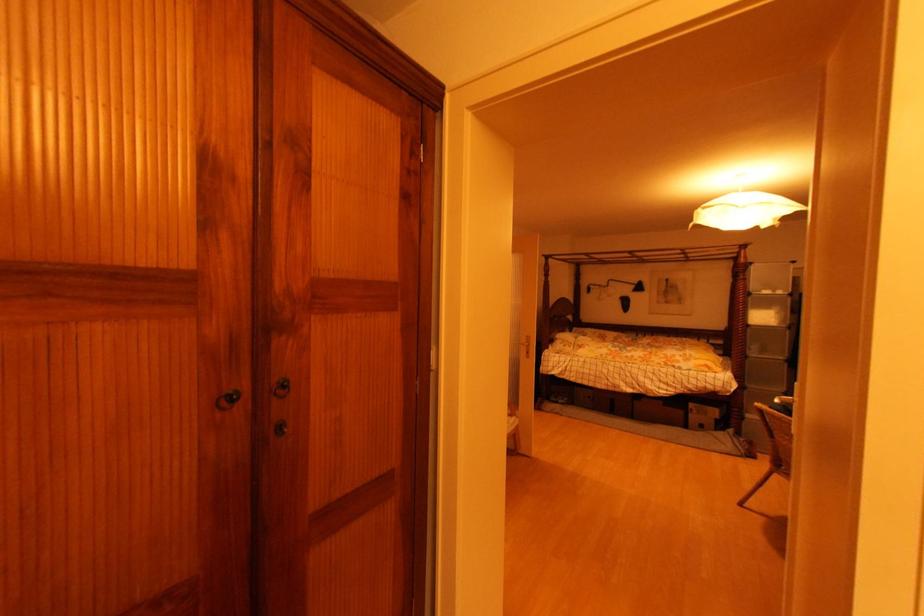
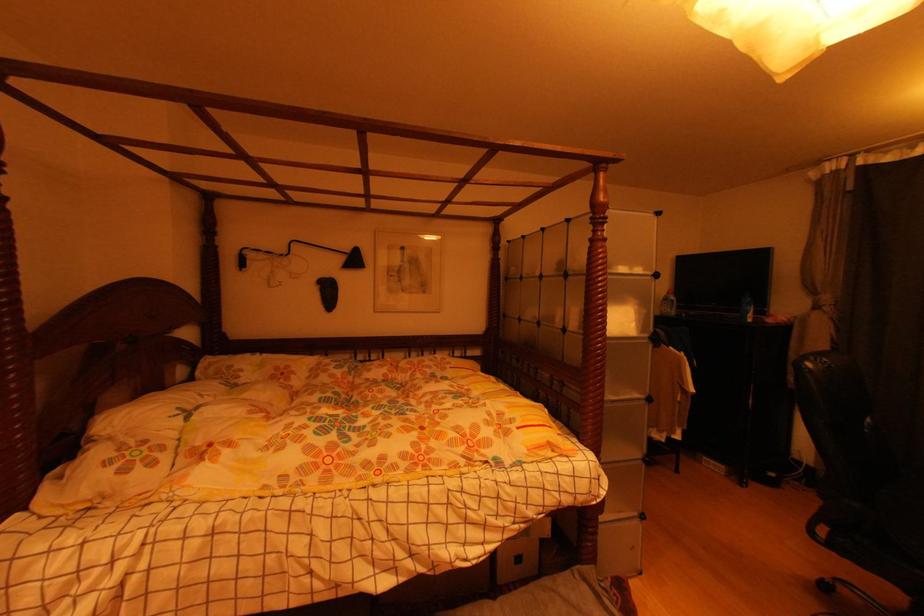
Locate, in the second image, the point that corresponds to point 638,288 in the first image.

(346, 261)